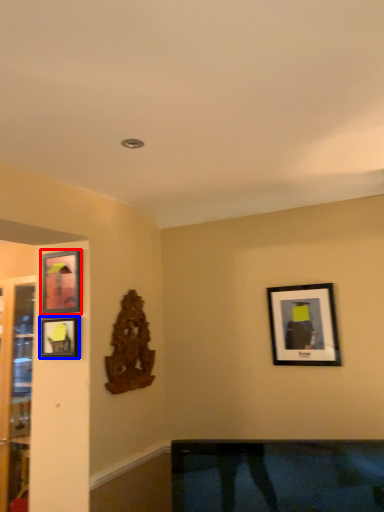
Question: Which object is further to the camera taking this photo, picture frame (highlighted by a red box) or picture frame (highlighted by a blue box)?

Choices:
 (A) picture frame
 (B) picture frame

Answer: (A)